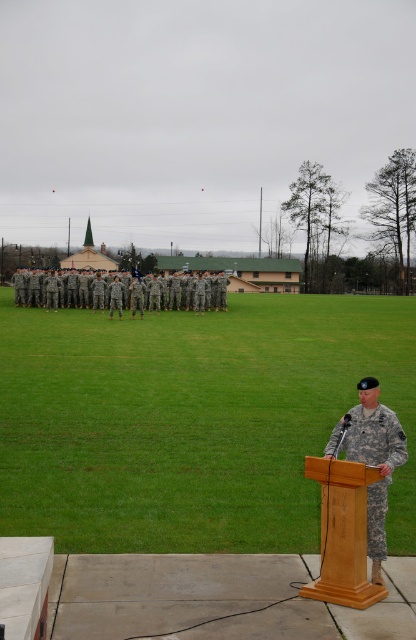
Which of these two, wooden podium at lower right or camouflage fabric uniform at right, stands shorter?

wooden podium at lower right is shorter.

Does wooden podium at lower right have a lesser height compared to camouflage fabric uniform at right?

Indeed, wooden podium at lower right has a lesser height compared to camouflage fabric uniform at right.

Identify the location of wooden podium at lower right. This screenshot has height=640, width=416. (343, 532).

Locate an element on the screen. This screenshot has height=640, width=416. wooden podium at lower right is located at coordinates click(x=343, y=532).

Can you confirm if camouflage fabric uniform at right is wider than camouflage uniform at center?

Incorrect, camouflage fabric uniform at right's width does not surpass camouflage uniform at center's.

Can you confirm if camouflage fabric uniform at right is thinner than camouflage uniform at center?

Correct, camouflage fabric uniform at right's width is less than camouflage uniform at center's.

Between point (373, 442) and point (185, 282), which one is positioned in front?

Point (373, 442) is in front.

In order to click on camouflage fabric uniform at right in this screenshot , I will do `click(376, 464)`.

Looking at this image, does wooden podium at lower right have a lesser width compared to camouflage uniform at center?

Yes.

Who is more forward, (x=321, y=467) or (x=37, y=300)?

Point (x=321, y=467)

Identify the location of wooden podium at lower right. Image resolution: width=416 pixels, height=640 pixels. (343, 532).